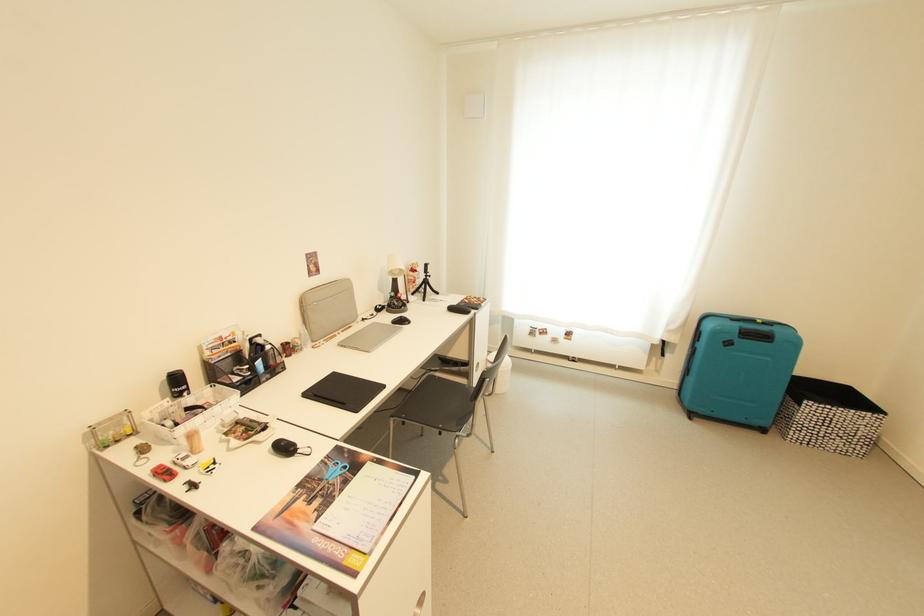
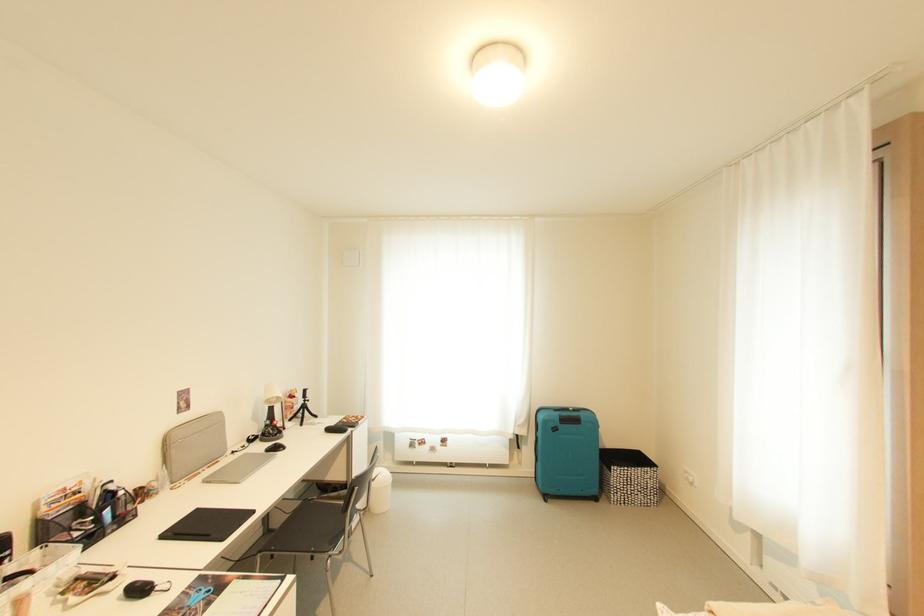
Locate, in the second image, the point that corresponds to [407,323] in the first image.

(282, 450)